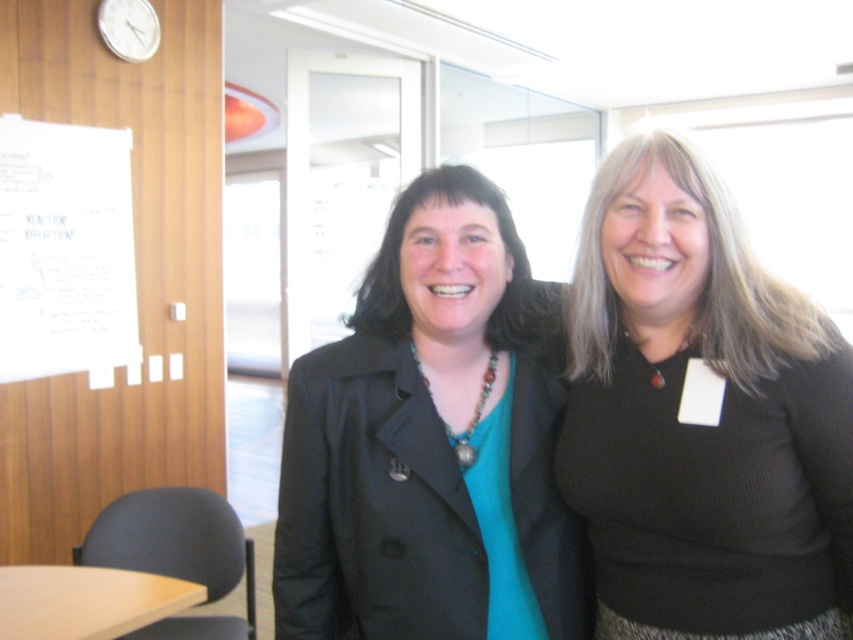
You are organizing a photo shoot and need to decide which item to place in a display case. The display case can only accommodate items smaller than the white paper at upper left. Based on the scene description, can the matte black jacket at center fit in the display case?

The matte black jacket at center is smaller than the white paper at upper left, so it can fit in the display case designed for items smaller than the white paper at upper left.

In the scene shown: You are a photographer taking a picture of the scene. You want to focus on the black ribbed sweater at right. Where should you aim your camera to capture it?

You should aim your camera at point 0.652 on the x axis and 0.823 on the y axis to capture the black ribbed sweater at right.

You are an interior designer assessing the layout of this professional office space. You notice the matte black jacket at center and the white paper at upper left. Which object occupies more vertical space in the scene?

The white paper at upper left is taller than the matte black jacket at center, so it occupies more vertical space.